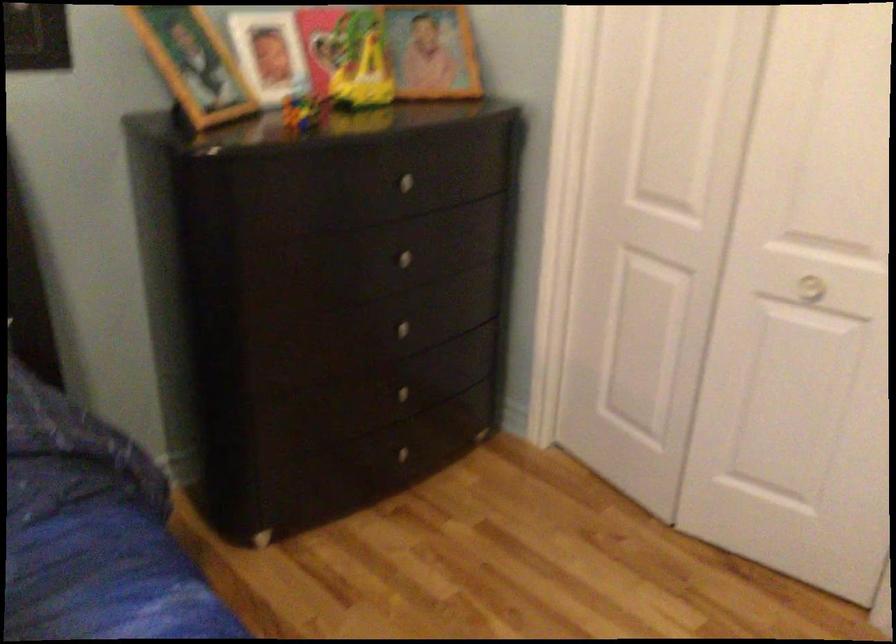
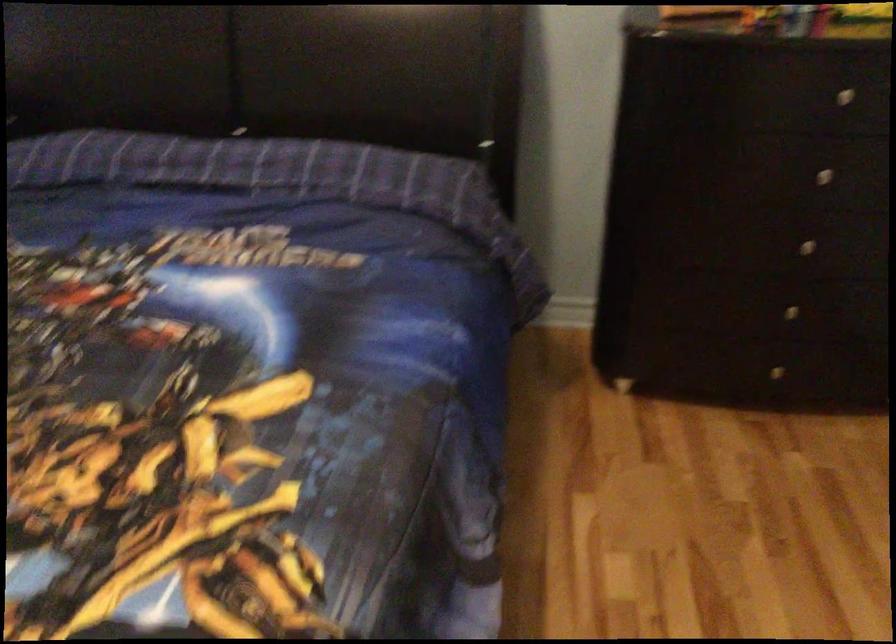
In the second image, find the point that corresponds to (x=409, y=327) in the first image.

(805, 245)